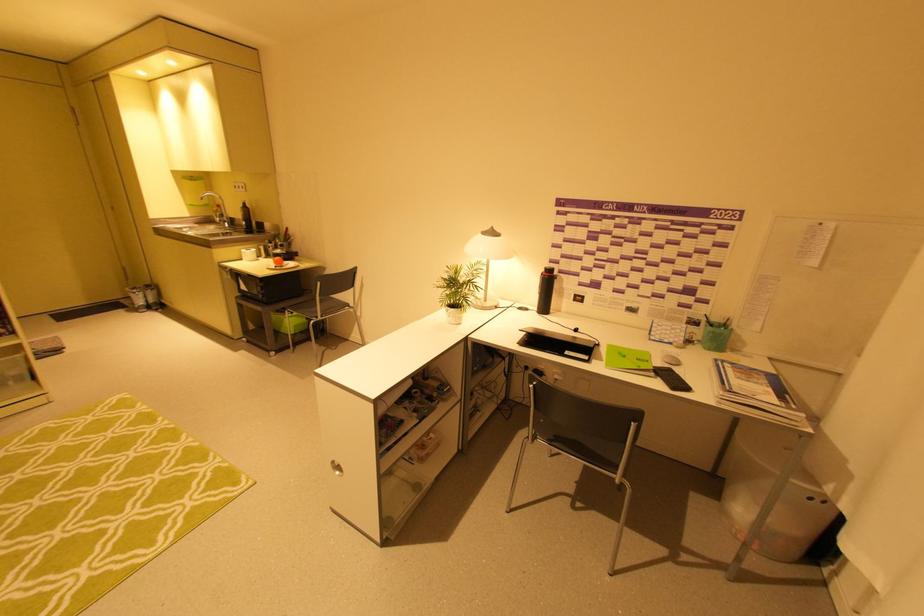
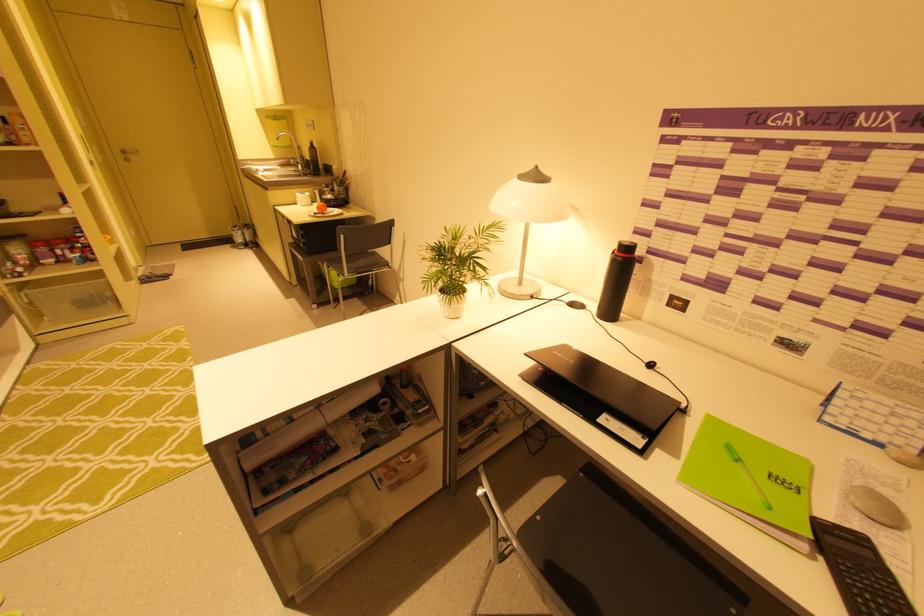
The point at [614,346] is marked in the first image. Where is the corresponding point in the second image?

(714, 419)